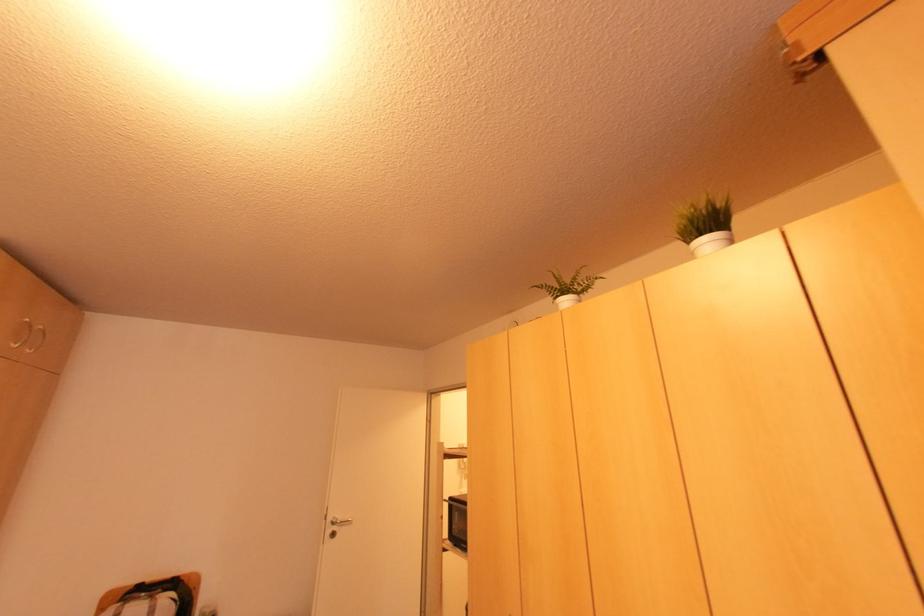
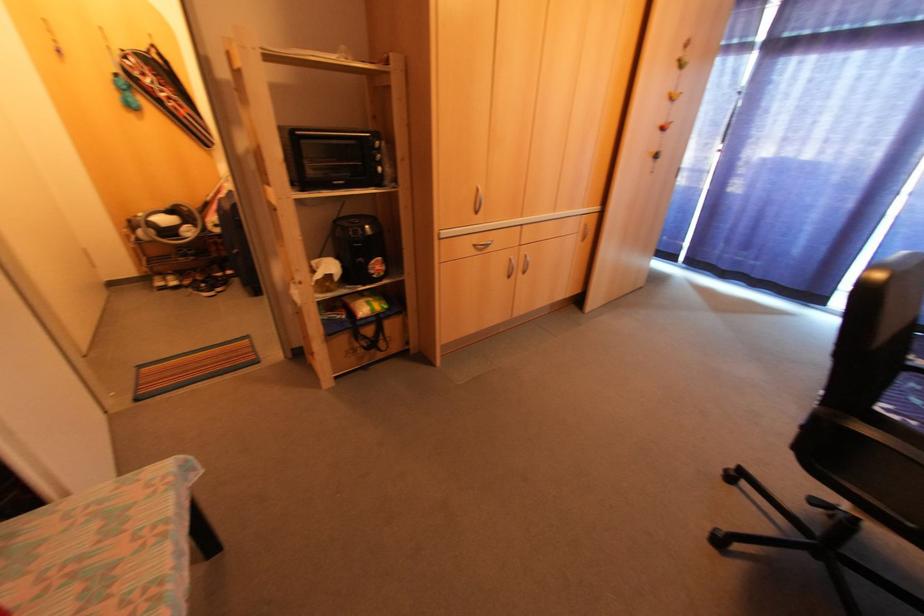
Find the pixel in the second image that matches [460,546] in the first image.

(334, 184)